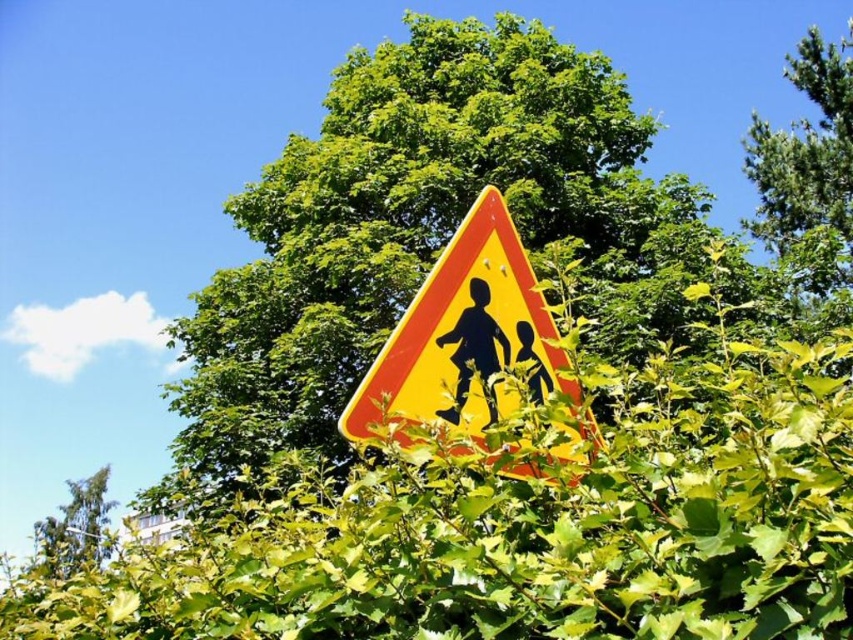
Looking at this image, you are standing at a point where you can see the triangular road sign with children silhouettes. If you want to place a 7 feet long ladder between you and the point at coordinates point (515, 468), will the ladder reach that point?

The distance between you and the point (515, 468) is 6.76 feet. Since the ladder is 7 feet long, it will reach the point as it is slightly longer than the distance.

You are driving a car and see the green leafy hedge at center and the matte yellow sign at center ahead. Which one is taller?

The green leafy hedge at center is taller than the matte yellow sign at center.

You are driving and need to see the matte yellow sign at center clearly. The green leafy hedge at center is blocking part of it. Can you estimate whether the hedge is wider than the sign?

The green leafy hedge at center is wider than the matte yellow sign at center, so the hedge is blocking more of the sign.